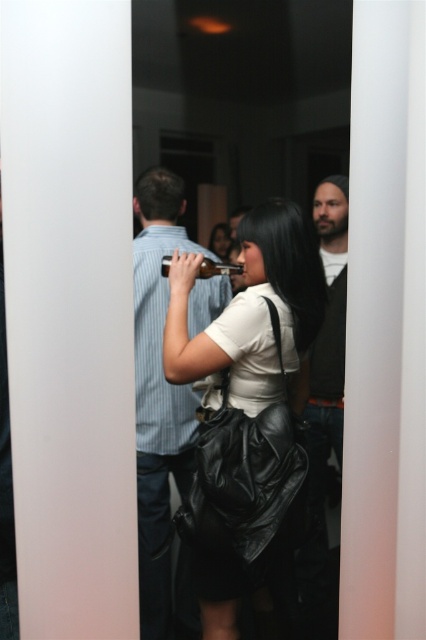
What is the location of the point with coordinates (287, 275) in the image?

The point with coordinates (287, 275) is located on the matte black bag at center.

You are at a social event and notice a dark brown leather jacket at right and a matte black purse at center. Which object is positioned lower in the scene?

The dark brown leather jacket at right is positioned below the matte black purse at center, so it is lower in the scene.